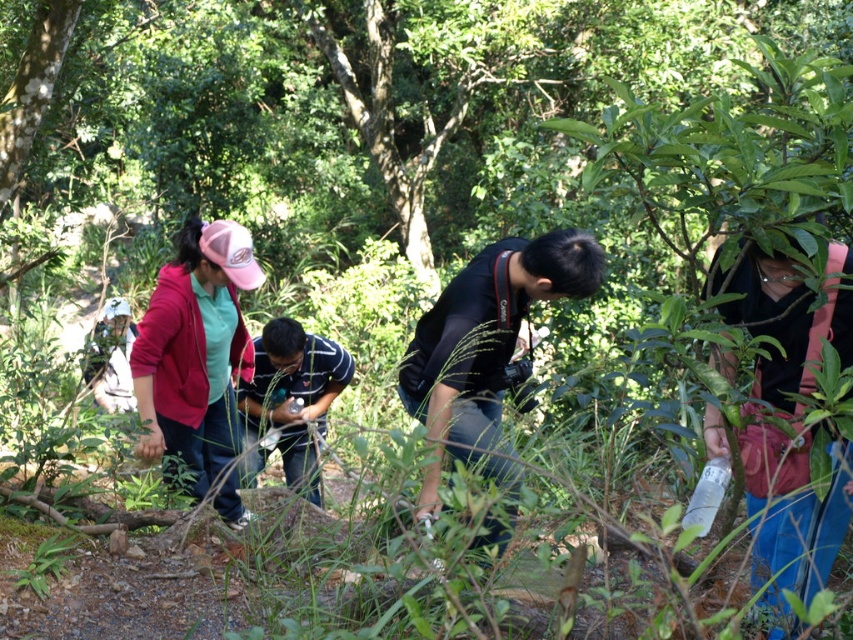
You are a photographer trying to capture a clear photo of the black matte camera at center. However, there is a green leafy tree at center blocking your view. Can you move the tree to get a better shot?

The green leafy tree at center is positioned over the black matte camera at center, so you cannot move the tree as it is part of the scene. Consider adjusting your angle or moving slightly to the side to frame the camera without the tree obstructing the view.

You are a photographer trying to decide which equipment to carry. You have a black matte camera at center and a striped cotton shirt at center. Which item requires more space in your backpack?

The black matte camera at center is larger in size than the striped cotton shirt at center, so it requires more space in the backpack.

You are a hiker trying to take a photo of the striped cotton shirt at center and the green leafy tree at center. Which object should you focus on first if you want to capture both in a single frame without moving the camera?

The green leafy tree at center is bigger than the striped cotton shirt at center, so you should focus on the green leafy tree at center first to ensure it fits properly in the frame before adjusting for the smaller striped cotton shirt at center.